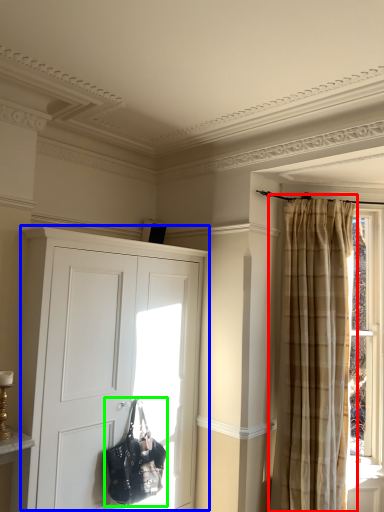
Question: Which object is the closest to the curtain (highlighted by a red box)? Choose among these: cupboard (highlighted by a blue box) or handbag (highlighted by a green box).

Choices:
 (A) cupboard
 (B) handbag

Answer: (A)